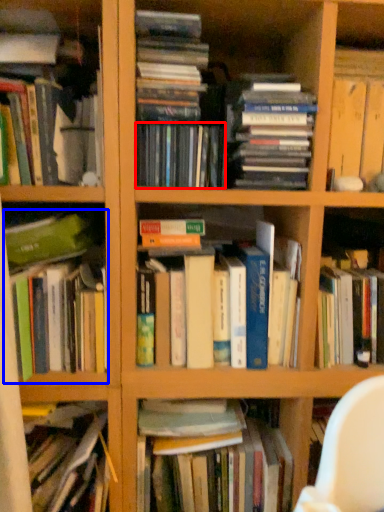
Question: Which of the following is the farthest to the observer, book (highlighted by a red box) or book (highlighted by a blue box)?

Choices:
 (A) book
 (B) book

Answer: (A)